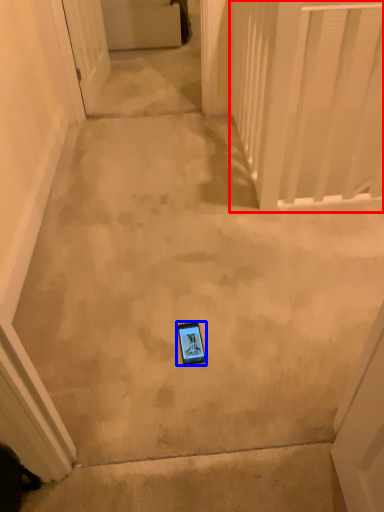
Question: Among these objects, which one is farthest to the camera, balustrade (highlighted by a red box) or mobile phone (highlighted by a blue box)?

Choices:
 (A) balustrade
 (B) mobile phone

Answer: (A)